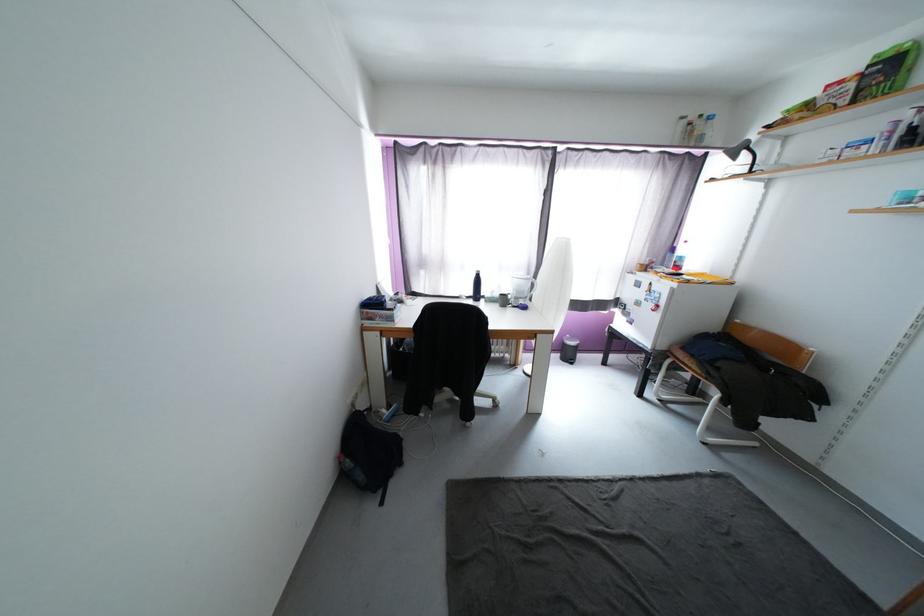
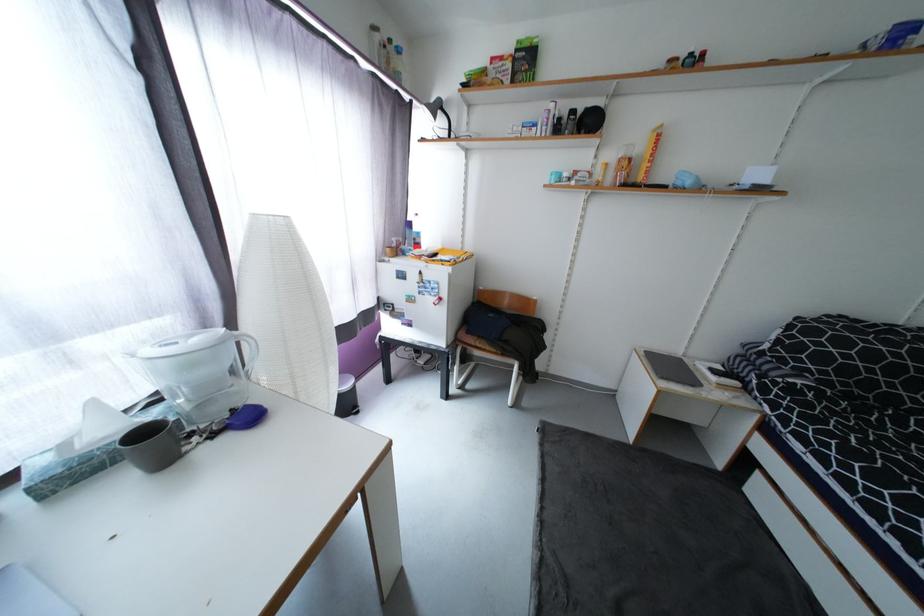
The point at (857, 86) is marked in the first image. Where is the corresponding point in the second image?

(515, 66)